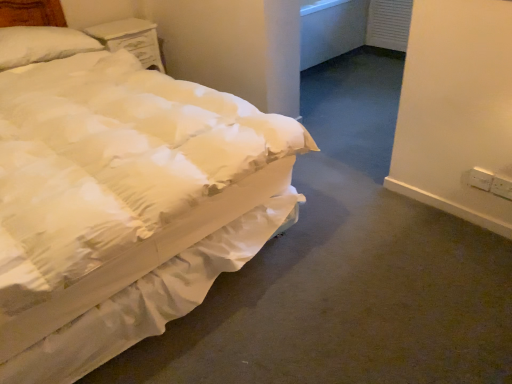
Question: Should I look upward or downward to see white painted wood nightstand at upper left?

Choices:
 (A) up
 (B) down

Answer: (A)

Question: Is white quilted fabric bed at left positioned behind white plastic electric outlet at lower right, which ranks as the second electric outlet in left-to-right order?

Choices:
 (A) no
 (B) yes

Answer: (A)

Question: Is white quilted fabric bed at left positioned beyond the bounds of white plastic electric outlet at lower right, which is the first electric outlet in right-to-left order?

Choices:
 (A) no
 (B) yes

Answer: (B)

Question: Can you confirm if white quilted fabric bed at left is wider than white plastic electric outlet at lower right, which ranks as the second electric outlet in left-to-right order?

Choices:
 (A) no
 (B) yes

Answer: (B)

Question: Can you confirm if white quilted fabric bed at left is thinner than white plastic electric outlet at lower right, which ranks as the second electric outlet in left-to-right order?

Choices:
 (A) no
 (B) yes

Answer: (A)

Question: Is white quilted fabric bed at left far from white plastic electric outlet at lower right, which ranks as the second electric outlet in left-to-right order?

Choices:
 (A) yes
 (B) no

Answer: (A)

Question: Would you say white quilted fabric bed at left contains white plastic electric outlet at lower right, which is the first electric outlet in right-to-left order?

Choices:
 (A) no
 (B) yes

Answer: (A)

Question: Considering the relative sizes of white quilted fabric bed at left and white soft pillow at upper left in the image provided, is white quilted fabric bed at left bigger than white soft pillow at upper left?

Choices:
 (A) yes
 (B) no

Answer: (A)

Question: Is white quilted fabric bed at left positioned in front of white soft pillow at upper left?

Choices:
 (A) no
 (B) yes

Answer: (B)

Question: Is white quilted fabric bed at left shorter than white soft pillow at upper left?

Choices:
 (A) yes
 (B) no

Answer: (B)

Question: Is white quilted fabric bed at left aimed at white soft pillow at upper left?

Choices:
 (A) yes
 (B) no

Answer: (B)

Question: Would you say white soft pillow at upper left is part of white quilted fabric bed at left's contents?

Choices:
 (A) yes
 (B) no

Answer: (A)

Question: Can we say white quilted fabric bed at left lies outside white soft pillow at upper left?

Choices:
 (A) no
 (B) yes

Answer: (B)

Question: From a real-world perspective, is white soft pillow at upper left on top of white plastic electric outlet at lower right, which is the first electric outlet in right-to-left order?

Choices:
 (A) no
 (B) yes

Answer: (B)